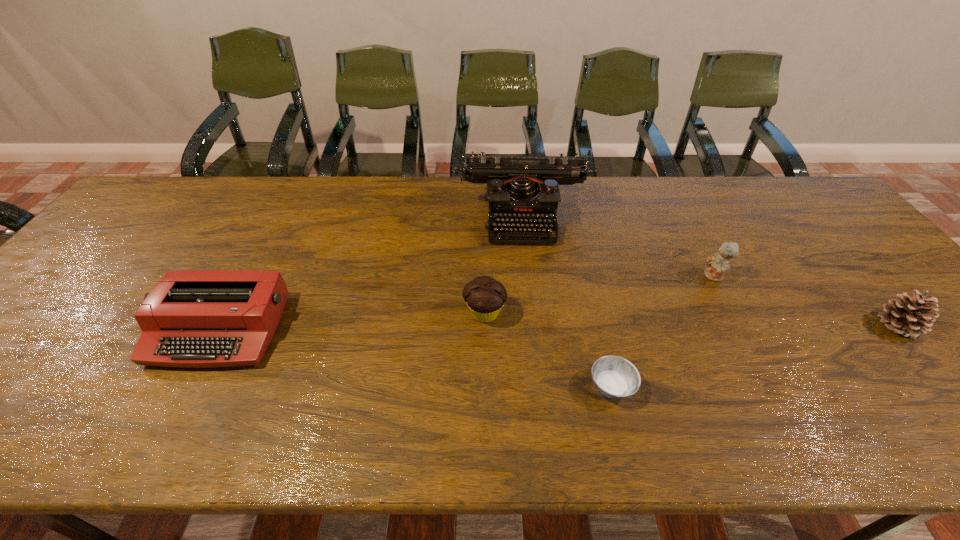
The width and height of the screenshot is (960, 540). I want to click on unoccupied position between the shortest object and the pinecone, so click(755, 356).

Locate an element on the screen. free space between the muffin and the left typewriter is located at coordinates (352, 321).

Find the location of `empty space between the teddy bear and the taller typewriter`. empty space between the teddy bear and the taller typewriter is located at coordinates (619, 246).

At what (x,y) coordinates should I click in order to perform the action: click on unoccupied area between the ashtray and the muffin. Please return your answer as a coordinate pair (x, y). The image size is (960, 540). Looking at the image, I should click on (548, 350).

Identify the location of vacant area between the fifth object from left to right and the rightmost object. This screenshot has height=540, width=960. (805, 301).

This screenshot has height=540, width=960. I want to click on object identified as the fourth closest to the fifth nearest object, so click(485, 296).

I want to click on object that stands as the third closest to the fifth object from left to right, so point(614,377).

What are the coordinates of `vacant position in the image that satisfies the following two spatial constraints: 1. on the front-facing side of the second object from right to left; 2. on the back side of the pinecone` in the screenshot? It's located at (740, 326).

Image resolution: width=960 pixels, height=540 pixels. I want to click on vacant position in the image that satisfies the following two spatial constraints: 1. on the front-facing side of the second farthest object; 2. on the right side of the pinecone, so click(740, 326).

The image size is (960, 540). Find the location of `vacant region that satisfies the following two spatial constraints: 1. on the front-facing side of the pinecone; 2. on the right side of the second farthest object`. vacant region that satisfies the following two spatial constraints: 1. on the front-facing side of the pinecone; 2. on the right side of the second farthest object is located at coordinates (740, 326).